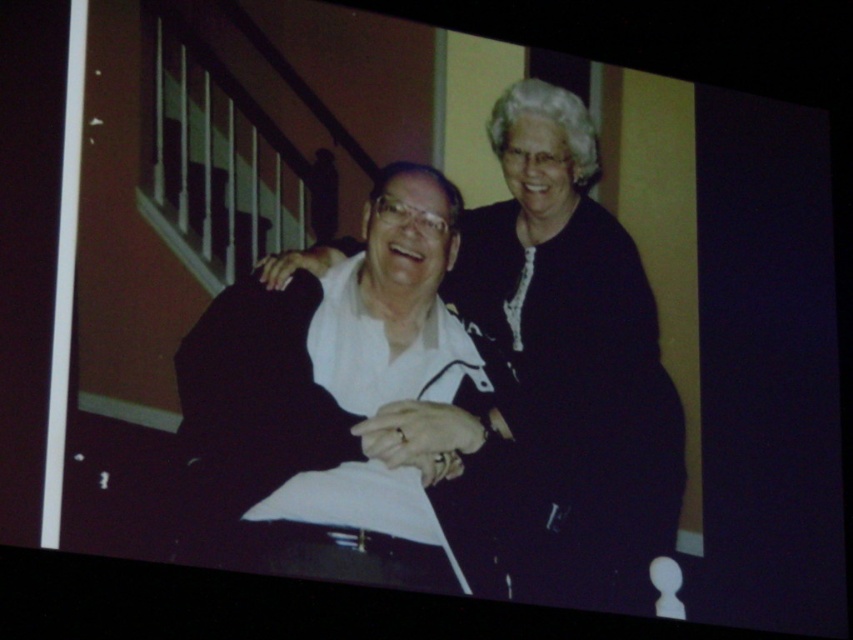
You are an event planner organizing a photoshoot and need to ensure that the black satin dress at center and the white matte shirt at center are visible in the frame. Given their sizes, which one might require more space in the composition?

The black satin dress at center is larger in size than the white matte shirt at center, so it would require more space in the composition to ensure visibility.

You are an event organizer arranging a fashion showcase. You have two garments displayed on mannequins in the center of the stage. The black satin dress at center and the white matte shirt at center. Based on the scene description, which garment should you place higher on the display rack to ensure proper visibility?

The black satin dress at center is taller than the white matte shirt at center, so placing the black satin dress higher on the display rack will ensure proper visibility as it is taller and requires more space.